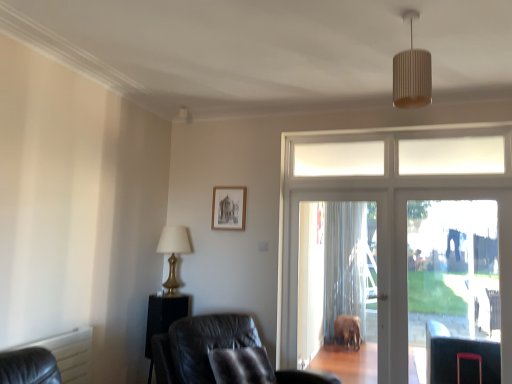
Locate an element on the screen. This screenshot has height=384, width=512. free point above translucent plastic screen door at center, acting as the first screen door starting from the left (from a real-world perspective) is located at coordinates (337, 185).